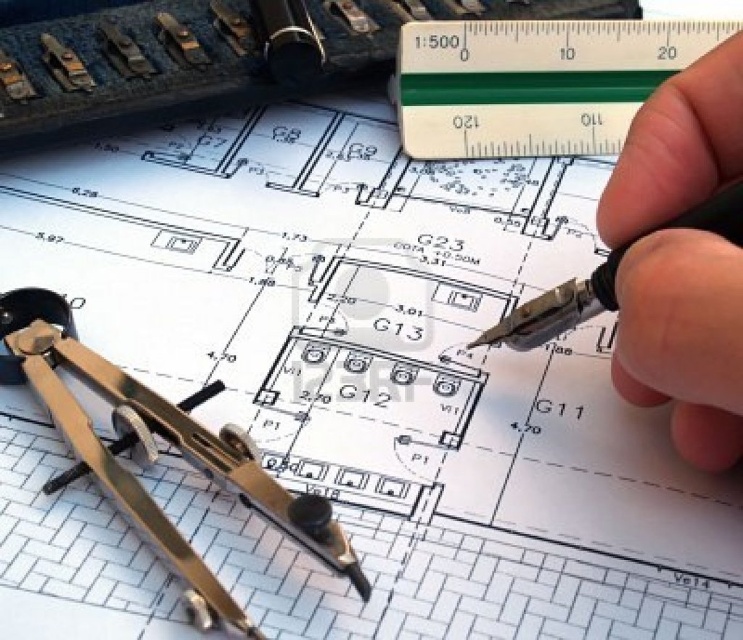
You are an architect working on the blueprint. You need to choose a pen to make bold annotations. Which pen should you use between the black pen at upper right and the metallic pen at center?

The black pen at upper right is bigger than the metallic pen at center, so you should use the black pen at upper right for bold annotations.

You are an architect working on the blueprint. You need to measure a 100m section on the blueprint which is scaled at 1.500. Which tool should you use between the transparent plastic ruler at upper center and the metallic compass at lower left?

The transparent plastic ruler at upper center should be used because it is smaller and more precise for measuring scaled distances on the blueprint.

You are an architect who needs to measure a section of the blueprint. You have the transparent plastic ruler at upper center and the metallic compass at lower left. Which tool is closer to you?

The metallic compass at lower left is behind the transparent plastic ruler at upper center, so the transparent plastic ruler at upper center is closer to you.